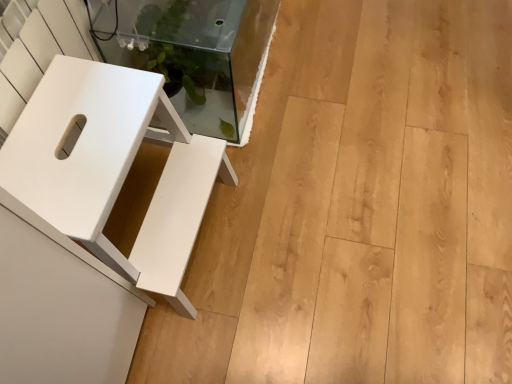
The height and width of the screenshot is (384, 512). I want to click on vacant space to the right of white matte stool at left, so click(x=285, y=232).